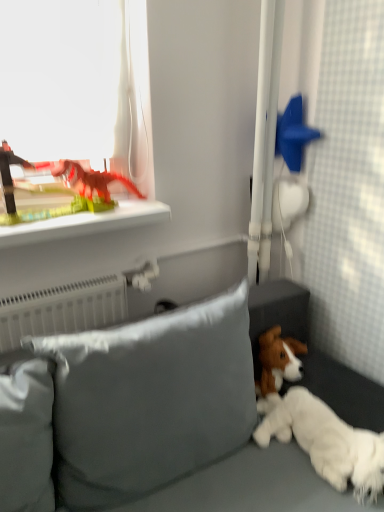
Find the location of a particular element. green plastic dinosaur at upper left is located at coordinates (85, 223).

Describe the element at coordinates (85, 223) in the screenshot. I see `green plastic dinosaur at upper left` at that location.

Measure the distance between point (275, 406) and camera.

The depth of point (275, 406) is 1.34 meters.

Describe the element at coordinates (325, 441) in the screenshot. This screenshot has height=512, width=384. I see `white fluffy dog at lower right` at that location.

Locate an element on the screen. Image resolution: width=384 pixels, height=512 pixels. matte plastic dinosaur at upper left, which is counted as the first toy, starting from the left is located at coordinates (59, 187).

The height and width of the screenshot is (512, 384). Find the location of `transparent plastic dinosaur at upper left`. transparent plastic dinosaur at upper left is located at coordinates (59, 77).

Locate an element on the screen. blue matte star at upper right, which is the first toy from right to left is located at coordinates (293, 134).

Describe the element at coordinates (150, 400) in the screenshot. Image resolution: width=384 pixels, height=512 pixels. I see `satin gray pillow at lower center` at that location.

Where is `green plastic dinosaur at upper left`? green plastic dinosaur at upper left is located at coordinates (85, 223).

Based on their positions, is transparent plastic dinosaur at upper left located to the left or right of satin gray pillow at lower center?

Clearly, transparent plastic dinosaur at upper left is on the left of satin gray pillow at lower center in the image.

Find the location of a particular element. The image size is (384, 512). window screen behind the satin gray pillow at lower center is located at coordinates (x=59, y=77).

From the image's perspective, does transparent plastic dinosaur at upper left appear higher than satin gray pillow at lower center?

Correct, transparent plastic dinosaur at upper left appears higher than satin gray pillow at lower center in the image.

Is the position of transparent plastic dinosaur at upper left more distant than that of satin gray pillow at lower center?

Yes.

Does white fluffy dog at lower right have a smaller size compared to blue matte star at upper right, acting as the 2th toy starting from the left?

No, white fluffy dog at lower right is not smaller than blue matte star at upper right, acting as the 2th toy starting from the left.

Consider the image. Which of these two, white fluffy dog at lower right or blue matte star at upper right, acting as the 2th toy starting from the left, is thinner?

Thinner between the two is blue matte star at upper right, acting as the 2th toy starting from the left.

Visually, is white fluffy dog at lower right positioned to the left or to the right of blue matte star at upper right, acting as the 2th toy starting from the left?

In the image, white fluffy dog at lower right appears on the right side of blue matte star at upper right, acting as the 2th toy starting from the left.

Is point (281, 411) closer to camera compared to point (291, 128)?

Yes, point (281, 411) is closer to viewer.

Which object is wider, white fluffy dog at lower right or green plastic dinosaur at upper left?

With larger width is green plastic dinosaur at upper left.

Considering the points (368, 437) and (58, 232), which point is in front, point (368, 437) or point (58, 232)?

The point (368, 437) is more forward.

Based on their positions, is white fluffy dog at lower right located to the left or right of green plastic dinosaur at upper left?

white fluffy dog at lower right is positioned on green plastic dinosaur at upper left's right side.

Does white fluffy dog at lower right turn towards green plastic dinosaur at upper left?

No, white fluffy dog at lower right does not turn towards green plastic dinosaur at upper left.

Can you tell me how much matte plastic dinosaur at upper left, placed as the second toy when sorted from right to left, and white fluffy dog at lower right differ in facing direction?

There is a 72.3-degree angle between the facing directions of matte plastic dinosaur at upper left, placed as the second toy when sorted from right to left, and white fluffy dog at lower right.

Where is `dog on the right of matte plastic dinosaur at upper left, placed as the second toy when sorted from right to left`? The width and height of the screenshot is (384, 512). dog on the right of matte plastic dinosaur at upper left, placed as the second toy when sorted from right to left is located at coordinates coord(325,441).

Considering the sizes of objects matte plastic dinosaur at upper left, which is counted as the first toy, starting from the left, and white fluffy dog at lower right in the image provided, who is wider, matte plastic dinosaur at upper left, which is counted as the first toy, starting from the left, or white fluffy dog at lower right?

With larger width is white fluffy dog at lower right.

Is matte plastic dinosaur at upper left, which is counted as the first toy, starting from the left, aimed at white fluffy dog at lower right?

No, matte plastic dinosaur at upper left, which is counted as the first toy, starting from the left, is not oriented towards white fluffy dog at lower right.

From a real-world perspective, is satin gray pillow at lower center positioned over blue matte star at upper right, acting as the 2th toy starting from the left, based on gravity?

Incorrect, from a real-world perspective, satin gray pillow at lower center is lower than blue matte star at upper right, acting as the 2th toy starting from the left.

This screenshot has width=384, height=512. I want to click on pillow directly beneath the blue matte star at upper right, acting as the 2th toy starting from the left (from a real-world perspective), so click(150, 400).

Between satin gray pillow at lower center and blue matte star at upper right, acting as the 2th toy starting from the left, which one has more height?

satin gray pillow at lower center is taller.

What's the angular difference between satin gray pillow at lower center and blue matte star at upper right, which is the first toy from right to left,'s facing directions?

There is a 89.3-degree angle between the facing directions of satin gray pillow at lower center and blue matte star at upper right, which is the first toy from right to left.

Is satin gray pillow at lower center inside the boundaries of matte plastic dinosaur at upper left, which is counted as the first toy, starting from the left, or outside?

satin gray pillow at lower center exists outside the volume of matte plastic dinosaur at upper left, which is counted as the first toy, starting from the left.

From the image's perspective, is satin gray pillow at lower center above or below matte plastic dinosaur at upper left, placed as the second toy when sorted from right to left?

Clearly, from the image's perspective, satin gray pillow at lower center is below matte plastic dinosaur at upper left, placed as the second toy when sorted from right to left.

Is matte plastic dinosaur at upper left, which is counted as the first toy, starting from the left, at the back of satin gray pillow at lower center?

No, satin gray pillow at lower center is not facing away from matte plastic dinosaur at upper left, which is counted as the first toy, starting from the left.

What's the angular difference between satin gray pillow at lower center and matte plastic dinosaur at upper left, placed as the second toy when sorted from right to left,'s facing directions?

They differ by 0.733 degrees in their facing directions.

Does point (298, 94) appear closer or farther from the camera than point (149, 365)?

Point (298, 94).

From the image's perspective, between blue matte star at upper right, which is the first toy from right to left, and satin gray pillow at lower center, which one is located above?

From the image's view, blue matte star at upper right, which is the first toy from right to left, is above.

Is blue matte star at upper right, acting as the 2th toy starting from the left, facing away from satin gray pillow at lower center?

No, blue matte star at upper right, acting as the 2th toy starting from the left,'s orientation is not away from satin gray pillow at lower center.

Between blue matte star at upper right, which is the first toy from right to left, and satin gray pillow at lower center, which one has larger size?

With larger size is satin gray pillow at lower center.

Locate an element on the screen. window screen behind the satin gray pillow at lower center is located at coordinates (59, 77).

I want to click on dog lying in front of the blue matte star at upper right, acting as the 2th toy starting from the left, so click(x=325, y=441).

Estimate the real-world distances between objects in this image. Which object is closer to blue matte star at upper right, which is the first toy from right to left, transparent plastic dinosaur at upper left or white fluffy dog at lower right?

The object closer to blue matte star at upper right, which is the first toy from right to left, is transparent plastic dinosaur at upper left.

Considering their positions, is white fluffy dog at lower right positioned closer to satin gray pillow at lower center than matte plastic dinosaur at upper left, which is counted as the first toy, starting from the left?

white fluffy dog at lower right is closer to satin gray pillow at lower center.

Considering their positions, is transparent plastic dinosaur at upper left positioned closer to white fluffy dog at lower right than blue matte star at upper right, which is the first toy from right to left?

blue matte star at upper right, which is the first toy from right to left.

When comparing their distances from blue matte star at upper right, which is the first toy from right to left, does green plastic dinosaur at upper left or satin gray pillow at lower center seem further?

Among the two, satin gray pillow at lower center is located further to blue matte star at upper right, which is the first toy from right to left.

Looking at the image, which one is located further to transparent plastic dinosaur at upper left, satin gray pillow at lower center or white fluffy dog at lower right?

Among the two, white fluffy dog at lower right is located further to transparent plastic dinosaur at upper left.

Considering their positions, is green plastic dinosaur at upper left positioned further to white fluffy dog at lower right than satin gray pillow at lower center?

green plastic dinosaur at upper left.

Considering their positions, is white fluffy dog at lower right positioned closer to matte plastic dinosaur at upper left, placed as the second toy when sorted from right to left, than blue matte star at upper right, which is the first toy from right to left?

blue matte star at upper right, which is the first toy from right to left, is closer to matte plastic dinosaur at upper left, placed as the second toy when sorted from right to left.

Which object lies nearer to the anchor point transparent plastic dinosaur at upper left, matte plastic dinosaur at upper left, which is counted as the first toy, starting from the left, or white fluffy dog at lower right?

matte plastic dinosaur at upper left, which is counted as the first toy, starting from the left, lies closer to transparent plastic dinosaur at upper left than the other object.

In order to click on pillow that lies between transparent plastic dinosaur at upper left and white fluffy dog at lower right from top to bottom in this screenshot , I will do `click(150, 400)`.

Find the location of a particular element. Image resolution: width=384 pixels, height=512 pixels. window sill between blue matte star at upper right, acting as the 2th toy starting from the left, and white fluffy dog at lower right, in the vertical direction is located at coordinates (85, 223).

Image resolution: width=384 pixels, height=512 pixels. Identify the location of window sill between transparent plastic dinosaur at upper left and white fluffy dog at lower right vertically. (85, 223).

The width and height of the screenshot is (384, 512). I want to click on window sill located between transparent plastic dinosaur at upper left and blue matte star at upper right, acting as the 2th toy starting from the left, in the left-right direction, so click(x=85, y=223).